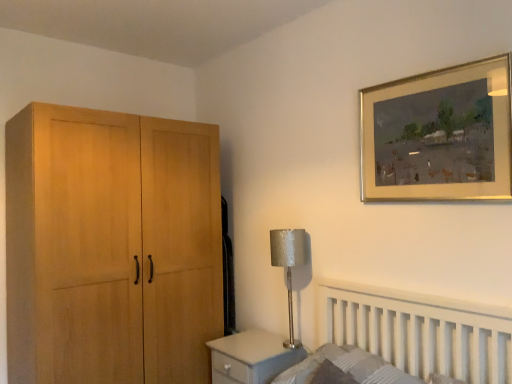
Question: Considering the relative sizes of textured gray mattress at lower right and gold-framed painting at upper right in the image provided, is textured gray mattress at lower right taller than gold-framed painting at upper right?

Choices:
 (A) yes
 (B) no

Answer: (B)

Question: Is textured gray mattress at lower right placed right next to gold-framed painting at upper right?

Choices:
 (A) no
 (B) yes

Answer: (A)

Question: From a real-world perspective, is textured gray mattress at lower right located beneath gold-framed painting at upper right?

Choices:
 (A) yes
 (B) no

Answer: (A)

Question: Is textured gray mattress at lower right looking in the opposite direction of gold-framed painting at upper right?

Choices:
 (A) yes
 (B) no

Answer: (B)

Question: Is textured gray mattress at lower right wider than gold-framed painting at upper right?

Choices:
 (A) yes
 (B) no

Answer: (A)

Question: Is point (503, 77) positioned closer to the camera than point (288, 284)?

Choices:
 (A) farther
 (B) closer

Answer: (B)

Question: Considering the positions of gold-framed painting at upper right and silver textured lampshade at center-right in the image, is gold-framed painting at upper right bigger or smaller than silver textured lampshade at center-right?

Choices:
 (A) small
 (B) big

Answer: (A)

Question: Considering the positions of gold-framed painting at upper right and silver textured lampshade at center-right in the image, is gold-framed painting at upper right wider or thinner than silver textured lampshade at center-right?

Choices:
 (A) wide
 (B) thin

Answer: (B)

Question: Would you say gold-framed painting at upper right is to the left or to the right of silver textured lampshade at center-right in the picture?

Choices:
 (A) left
 (B) right

Answer: (B)

Question: Is point (287, 264) closer or farther from the camera than point (223, 382)?

Choices:
 (A) closer
 (B) farther

Answer: (A)

Question: From a real-world perspective, is silver textured lampshade at center-right positioned above or below matte gray changing table at lower center?

Choices:
 (A) below
 (B) above

Answer: (B)

Question: Looking at the image, does silver textured lampshade at center-right seem bigger or smaller compared to matte gray changing table at lower center?

Choices:
 (A) small
 (B) big

Answer: (A)

Question: Would you say silver textured lampshade at center-right is inside or outside matte gray changing table at lower center?

Choices:
 (A) inside
 (B) outside

Answer: (B)

Question: Considering the positions of point (378, 195) and point (384, 364), is point (378, 195) closer or farther from the camera than point (384, 364)?

Choices:
 (A) farther
 (B) closer

Answer: (A)

Question: Would you say gold-framed painting at upper right is inside or outside textured gray mattress at lower right?

Choices:
 (A) outside
 (B) inside

Answer: (A)